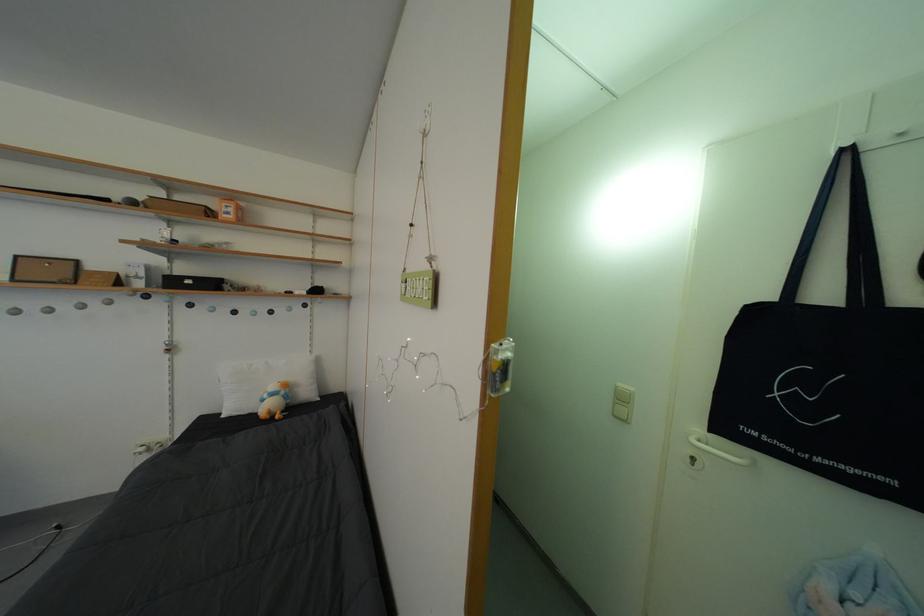
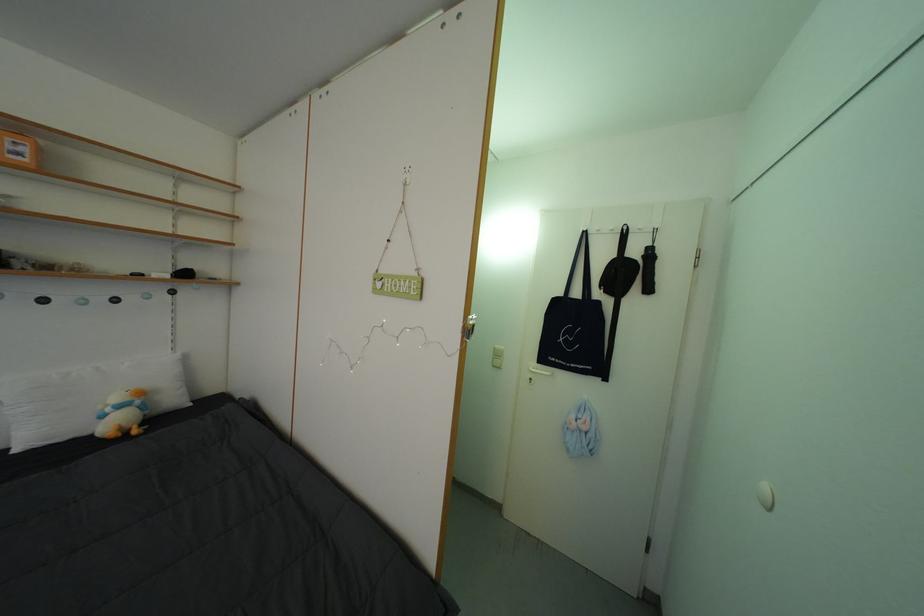
The point at (237, 220) is marked in the first image. Where is the corresponding point in the second image?

(27, 160)